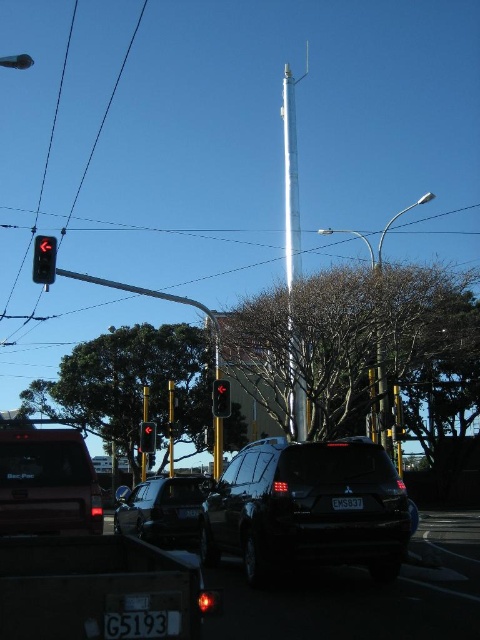
You are a pedestrian standing at the crosswalk. You need to check if the black plastic license plate at lower center is positioned below the matte black traffic light at left to ensure you can see both while waiting. Is this the case?

Yes, the black plastic license plate at lower center is below the matte black traffic light at left, so you can see both while waiting.

You are a pedestrian standing at the crosswalk and want to cross the street. There are two points marked in the image. The first point is at coordinate point (169, 618) and the second is at coordinate point (50, 259). Which point is closer to you as you stand at the crosswalk?

Point (169, 618) is closer to the viewer than point (50, 259).

You are a pedestrian standing at the crosswalk near the intersection. You see the black plastic license plate at lower center and the matte black traffic light at center. Which object is closer to your right side?

The black plastic license plate at lower center is to the right of the matte black traffic light at center, so it is closer to your right side.